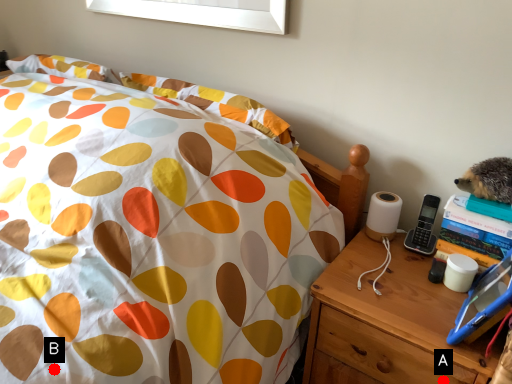
Question: Two points are circled on the image, labeled by A and B beside each circle. Which of the following is the farthest from the observer?

Choices:
 (A) A is further
 (B) B is further

Answer: (A)